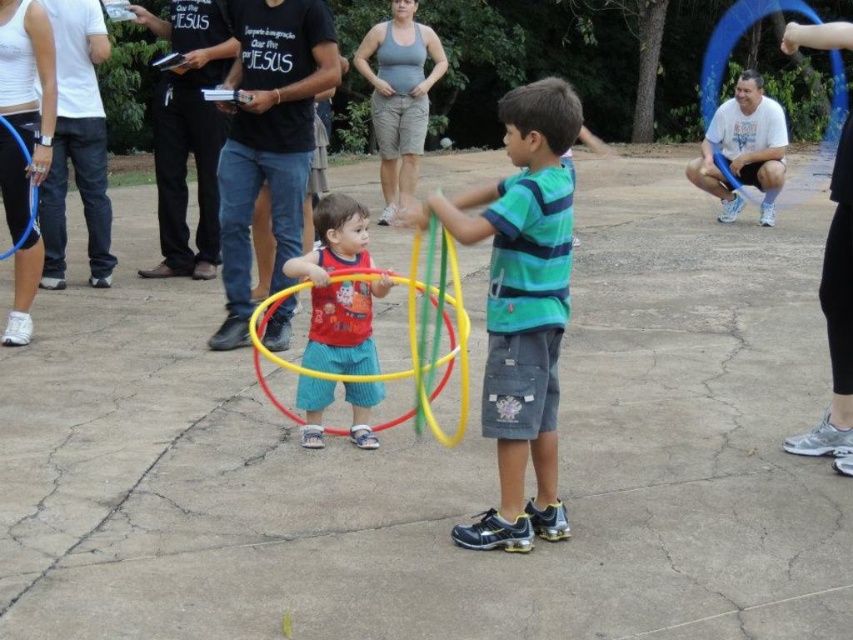
You are standing at the origin point of the coordinate system. You want to move towards the point marked as point (339,289). What object will you encounter first?

The point (339,289) corresponds to the matte red hula hoop at center, so you will encounter the matte red hula hoop at center first.

You are a photographer trying to capture a candid shot of both the green striped shirt at center and the white cotton shirt at right. Since you want to ensure both subjects are in focus, which one should you focus on first to maintain depth of field?

You should focus on the green striped shirt at center first because it is closer to the camera than the white cotton shirt at right, ensuring both are in focus when using depth of field.